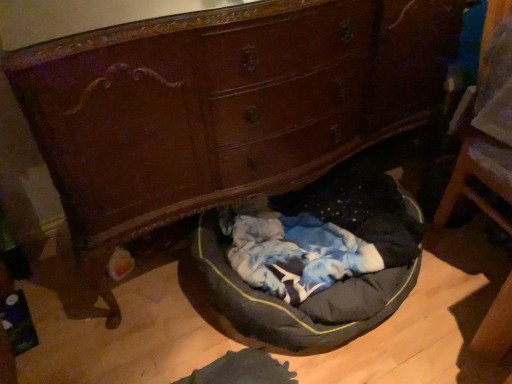
This screenshot has height=384, width=512. What are the coordinates of `free space below wooden chair at right (from a real-world perspective)` in the screenshot? It's located at (477, 245).